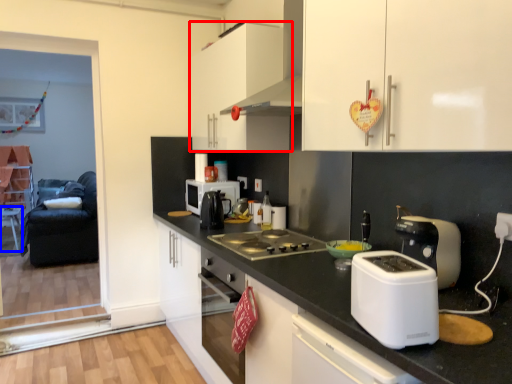
Question: Which object is closer to the camera taking this photo, cabinetry (highlighted by a red box) or table (highlighted by a blue box)?

Choices:
 (A) cabinetry
 (B) table

Answer: (A)